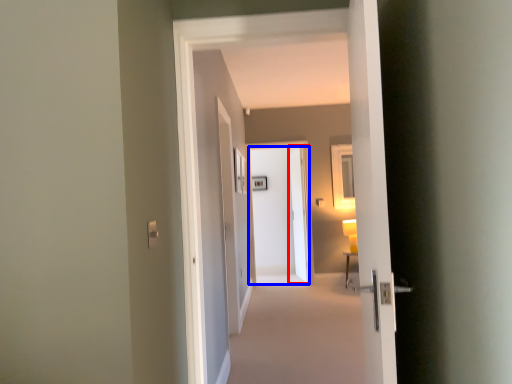
Question: Which point is further to the camera, screen door (highlighted by a red box) or door (highlighted by a blue box)?

Choices:
 (A) screen door
 (B) door

Answer: (A)